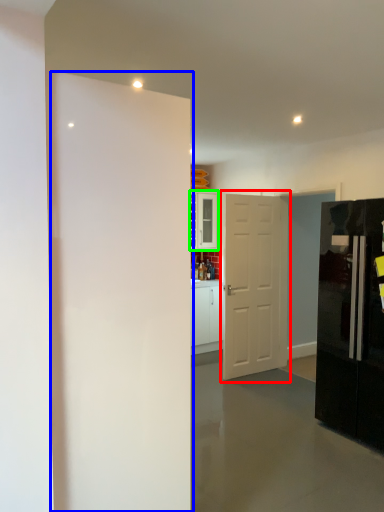
Question: Considering the real-world distances, which object is farthest from door (highlighted by a red box)? door (highlighted by a blue box) or cabinetry (highlighted by a green box)?

Choices:
 (A) door
 (B) cabinetry

Answer: (A)